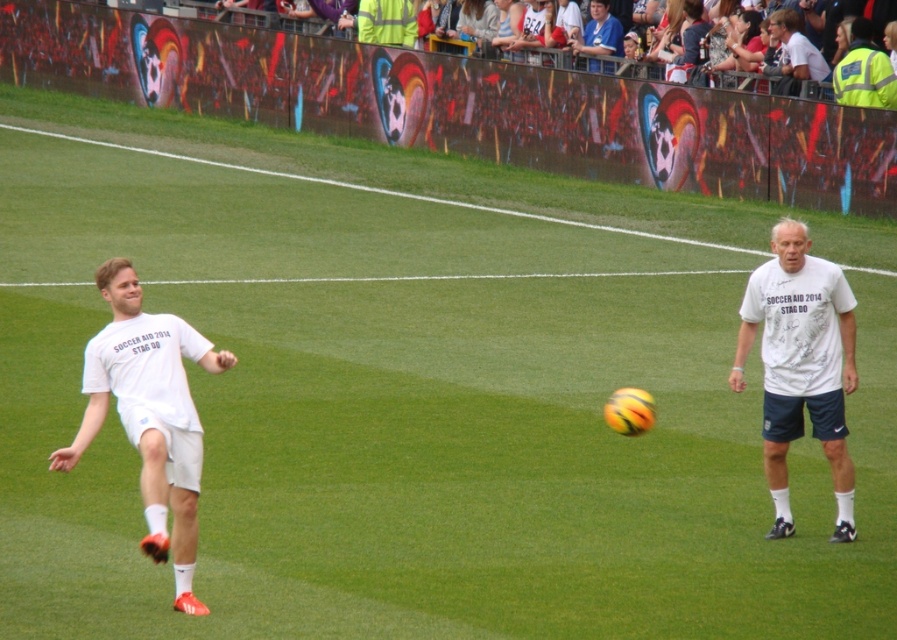
Question: Does white matte t-shirt at left have a smaller size compared to white cotton t-shirt at center?

Choices:
 (A) no
 (B) yes

Answer: (A)

Question: Which object is closer to the camera taking this photo?

Choices:
 (A) white matte t-shirt at left
 (B) white cotton t-shirt at center

Answer: (A)

Question: Which point appears farthest from the camera in this image?

Choices:
 (A) (187, 392)
 (B) (835, 476)

Answer: (B)

Question: Is the position of white matte t-shirt at left more distant than that of white cotton shirt at upper center?

Choices:
 (A) yes
 (B) no

Answer: (B)

Question: Considering the relative positions of white cotton t-shirt at center and white cotton shirt at upper center in the image provided, where is white cotton t-shirt at center located with respect to white cotton shirt at upper center?

Choices:
 (A) above
 (B) below

Answer: (B)

Question: Which object is farther from the camera taking this photo?

Choices:
 (A) white cotton t-shirt at center
 (B) white matte t-shirt at left
 (C) white cotton shirt at upper center

Answer: (C)